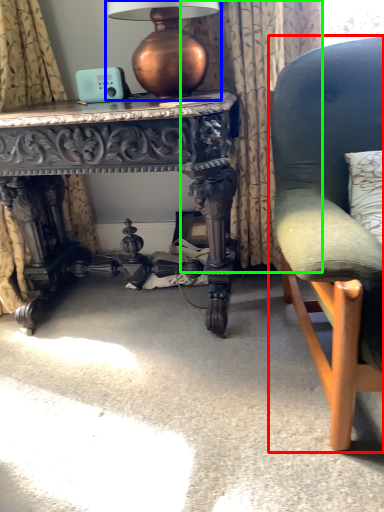
Question: Based on their relative distances, which object is farther from chair (highlighted by a red box)? Choose from table lamp (highlighted by a blue box) and curtain (highlighted by a green box).

Choices:
 (A) table lamp
 (B) curtain

Answer: (A)